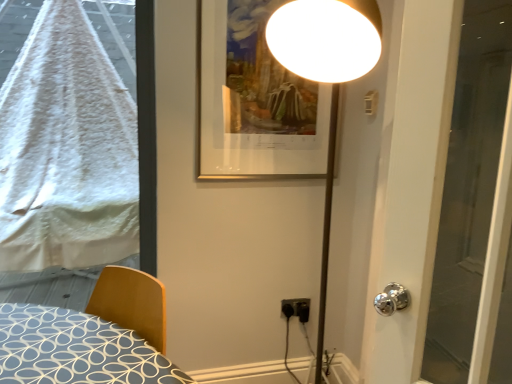
Question: In terms of size, does white fluffy blanket at left appear bigger or smaller than black plastic electric outlet at lower center?

Choices:
 (A) big
 (B) small

Answer: (A)

Question: Is white fluffy blanket at left in front of or behind black plastic electric outlet at lower center in the image?

Choices:
 (A) front
 (B) behind

Answer: (A)

Question: Considering the real-world distances, which object is farthest from the black plastic electric outlet at lower center?

Choices:
 (A) white fluffy blanket at left
 (B) wooden bed at lower left
 (C) transparent glass door at right
 (D) gold metallic picture frame at upper center

Answer: (A)

Question: Estimate the real-world distances between objects in this image. Which object is closer to the wooden bed at lower left?

Choices:
 (A) gold metallic picture frame at upper center
 (B) white fluffy blanket at left
 (C) transparent glass door at right
 (D) black plastic electric outlet at lower center

Answer: (A)